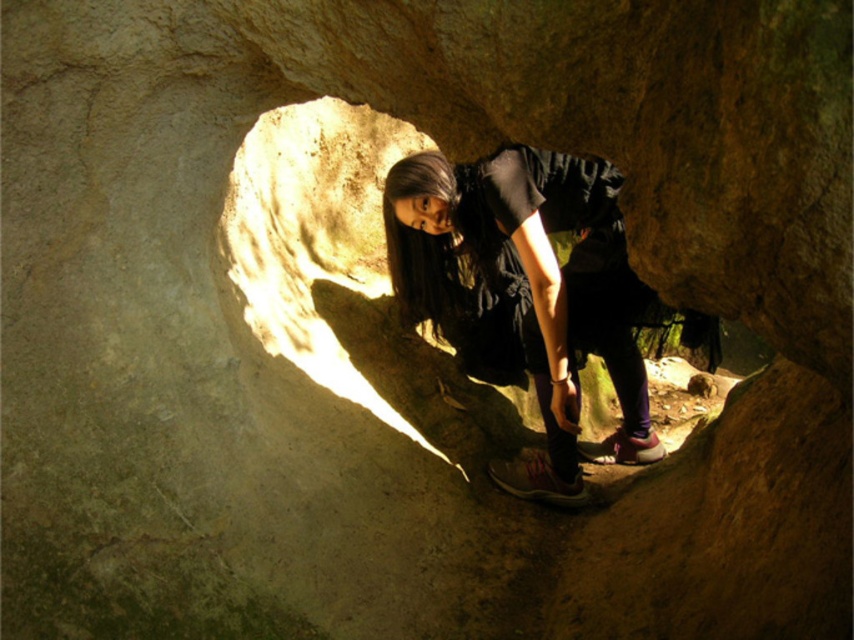
Does matte black dress at center come in front of pink suede shoe at lower center?

Yes, matte black dress at center is in front of pink suede shoe at lower center.

Based on the photo, can you confirm if matte black dress at center is wider than pink suede shoe at lower center?

Yes, matte black dress at center is wider than pink suede shoe at lower center.

Is point (436, 160) farther from camera compared to point (626, 438)?

No, (436, 160) is in front of (626, 438).

Find the location of `matte black dress at center`. matte black dress at center is located at coordinates (525, 282).

Does smooth stone hole at center appear on the left side of pink suede shoe at lower center?

Yes, smooth stone hole at center is to the left of pink suede shoe at lower center.

Does smooth stone hole at center come in front of pink suede shoe at lower center?

Yes, it is in front of pink suede shoe at lower center.

Which is behind, point (383, 125) or point (661, 451)?

Point (383, 125)

Where is `smooth stone hole at center`? The height and width of the screenshot is (640, 854). smooth stone hole at center is located at coordinates (319, 248).

Can you confirm if matte black dress at center is positioned above matte pink sneaker at lower center?

Indeed, matte black dress at center is positioned over matte pink sneaker at lower center.

Does matte black dress at center appear on the right side of matte pink sneaker at lower center?

In fact, matte black dress at center is to the left of matte pink sneaker at lower center.

Is point (594, 353) more distant than point (540, 483)?

Yes.

At what (x,y) coordinates should I click in order to perform the action: click on matte black dress at center. Please return your answer as a coordinate pair (x, y). This screenshot has width=854, height=640. Looking at the image, I should click on (525, 282).